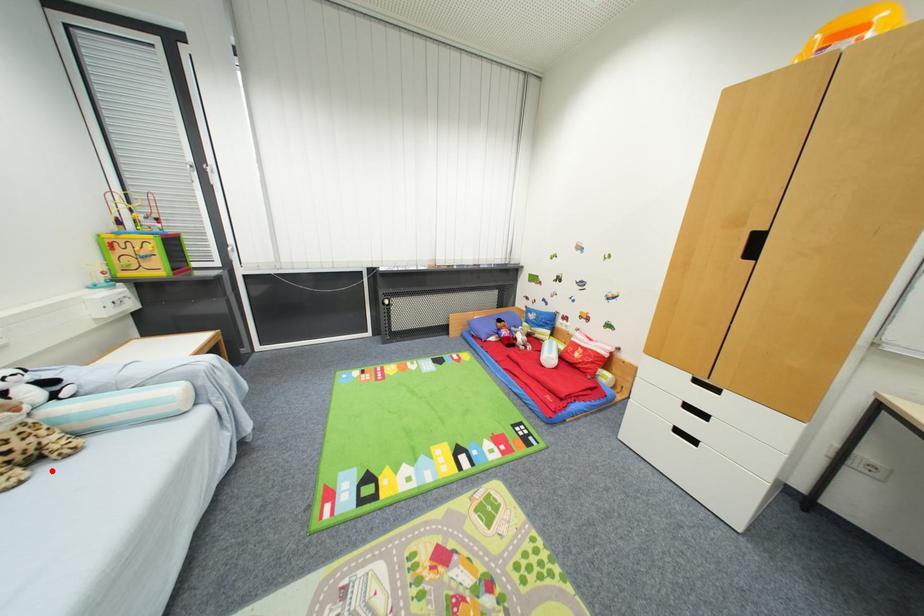
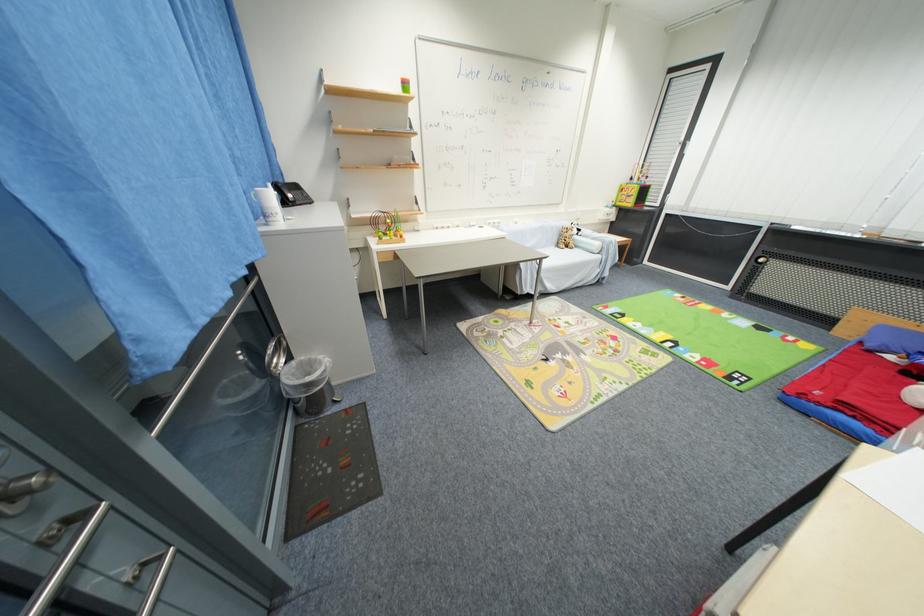
Question: I am providing you with two images of the same scene from different viewpoints. In image1, a red point is highlighted. Considering the same 3D point in image2, which of the following is correct?

Choices:
 (A) It is closer
 (B) It is farther

Answer: (B)